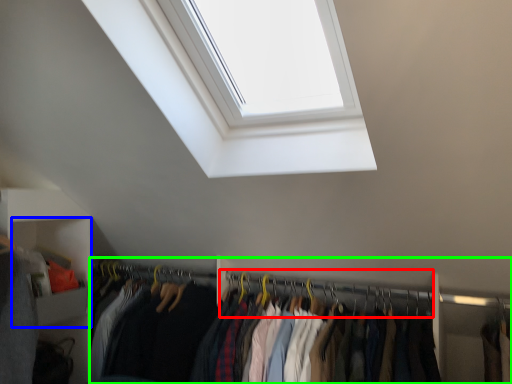
Question: Considering the real-world distances, which object is closest to hanger (highlighted by a red box)? cabinet (highlighted by a blue box) or closet (highlighted by a green box).

Choices:
 (A) cabinet
 (B) closet

Answer: (B)